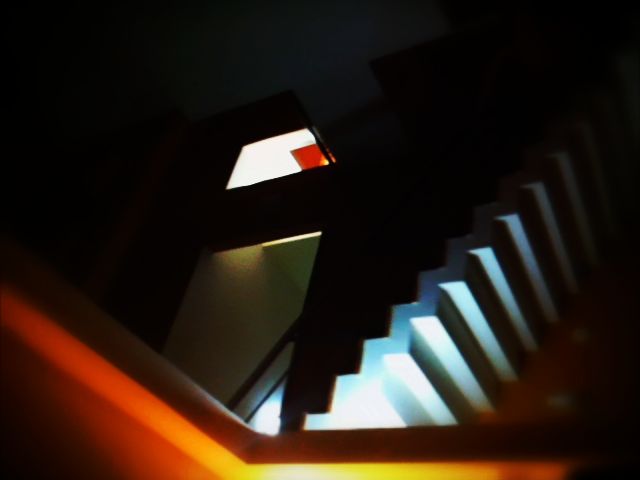
Where is `shadow on step`? shadow on step is located at coordinates (484, 371), (506, 332), (532, 309), (556, 278), (573, 237), (460, 402).